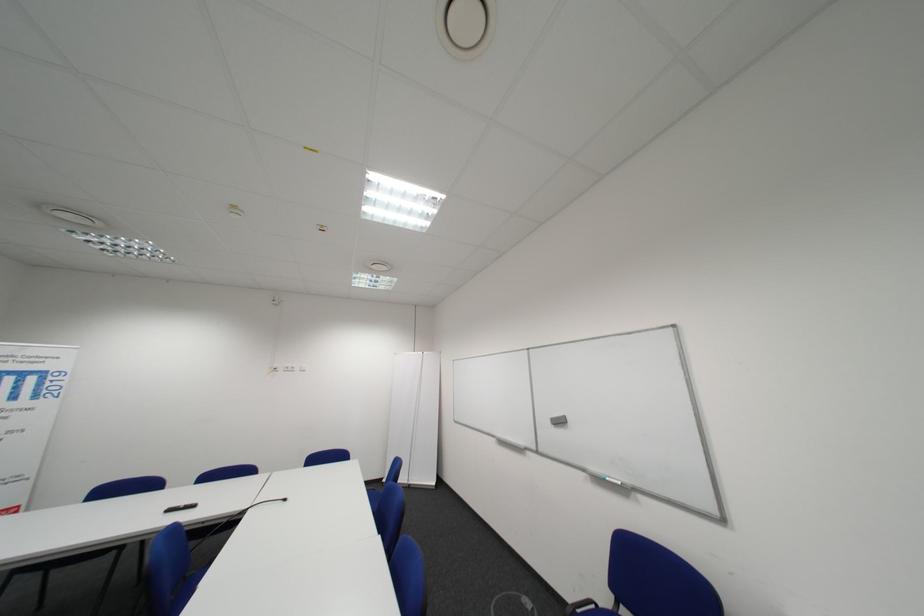
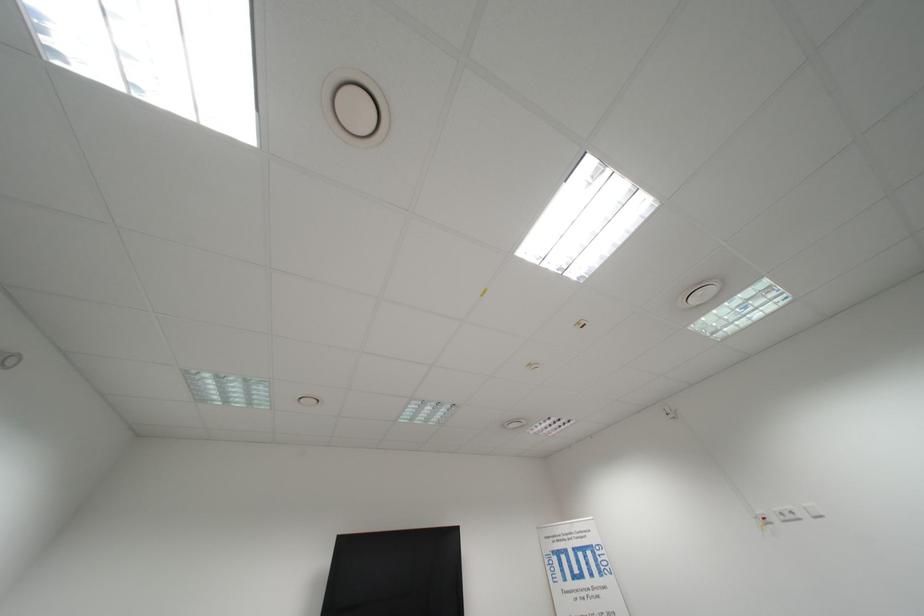
Find the pixel in the second image that matches [298,371] in the first image.

(796, 519)